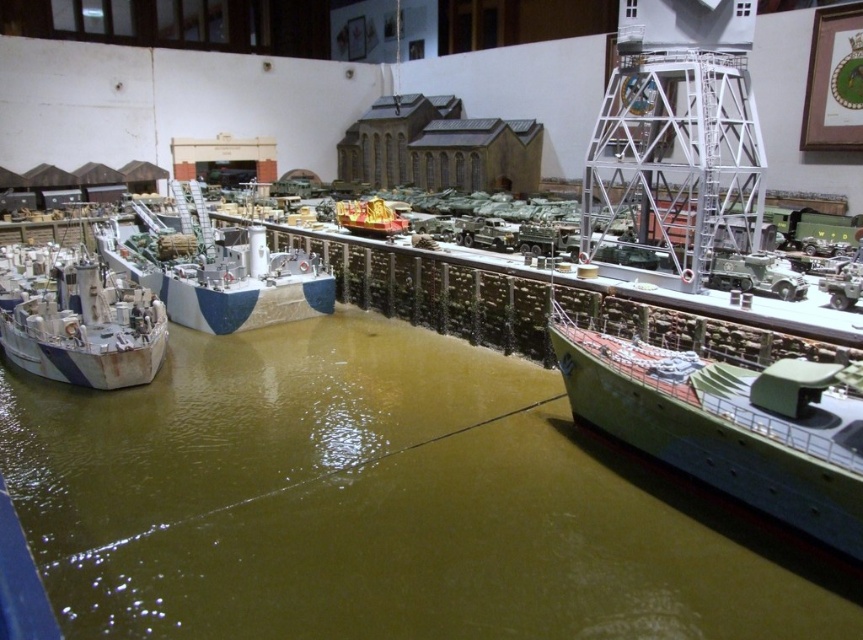
Between point (400, 429) and point (57, 380), which one is positioned behind?

The point (57, 380) is behind.

Is green matte water at center thinner than rusty metal ship at left?

No.

Does point (127, 589) come in front of point (124, 365)?

Yes, point (127, 589) is closer to viewer.

This screenshot has width=863, height=640. I want to click on green matte water at center, so click(378, 504).

Is the position of green matte ship at center less distant than that of rusty metal ship at left?

Yes, green matte ship at center is closer to the viewer.

Does green matte ship at center have a lesser width compared to rusty metal ship at left?

No, green matte ship at center is not thinner than rusty metal ship at left.

Does point (773, 426) come behind point (89, 314)?

That is False.

The image size is (863, 640). I want to click on green matte ship at center, so click(x=729, y=424).

Does green matte water at center have a larger size compared to green matte ship at center?

Correct, green matte water at center is larger in size than green matte ship at center.

What do you see at coordinates (378, 504) in the screenshot? This screenshot has width=863, height=640. I see `green matte water at center` at bounding box center [378, 504].

Is point (154, 429) more distant than point (564, 362)?

Yes, it is behind point (564, 362).

Where is `green matte water at center`? green matte water at center is located at coordinates (378, 504).